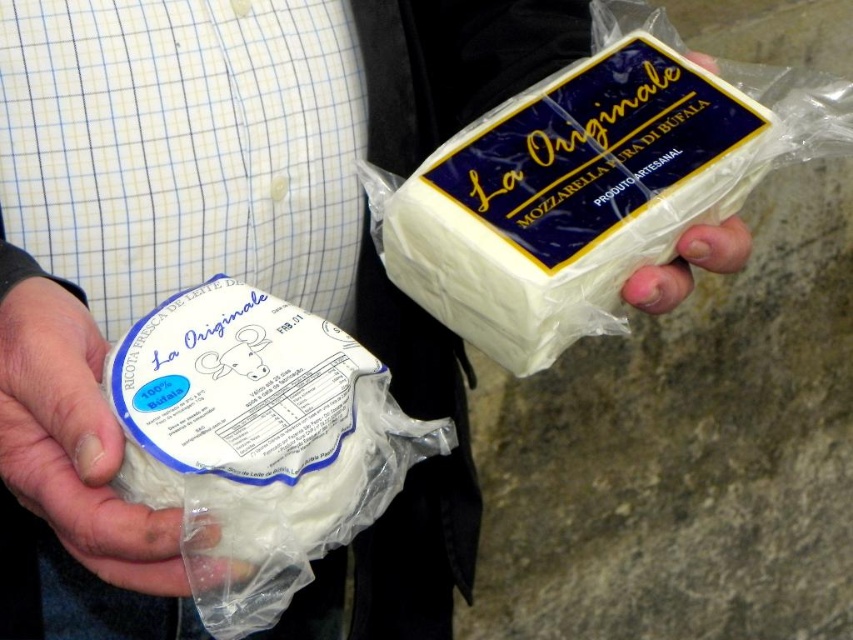
Question: Which of these objects is positioned farthest from the white creamy mozzarella at upper right?

Choices:
 (A) white creamy cheese at left
 (B) white matte cheese at left
 (C) pale skin at center

Answer: (B)

Question: Can you confirm if white matte cheese at left is bigger than pale skin at center?

Choices:
 (A) yes
 (B) no

Answer: (A)

Question: Does white creamy mozzarella at upper right have a smaller size compared to white creamy cheese at left?

Choices:
 (A) yes
 (B) no

Answer: (B)

Question: Which point is farther to the camera?

Choices:
 (A) pale skin at center
 (B) white creamy mozzarella at upper right
 (C) white creamy cheese at left
 (D) white matte cheese at left

Answer: (A)

Question: Does white matte cheese at left lie behind pale skin at center?

Choices:
 (A) no
 (B) yes

Answer: (A)

Question: Which point is farther to the camera?

Choices:
 (A) white creamy mozzarella at upper right
 (B) white matte cheese at left

Answer: (A)